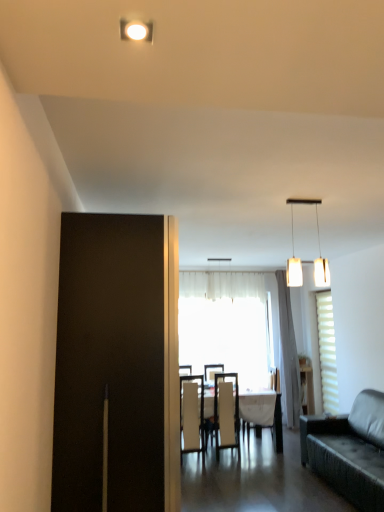
Question: Are white matte pendant lights at upper center and white sheer curtain at center making contact?

Choices:
 (A) yes
 (B) no

Answer: (B)

Question: Can you confirm if white matte pendant lights at upper center is smaller than white sheer curtain at center?

Choices:
 (A) no
 (B) yes

Answer: (B)

Question: Does white matte pendant lights at upper center appear on the right side of white sheer curtain at center?

Choices:
 (A) yes
 (B) no

Answer: (B)

Question: Is white matte pendant lights at upper center aimed at white sheer curtain at center?

Choices:
 (A) yes
 (B) no

Answer: (B)

Question: From a real-world perspective, is white matte pendant lights at upper center below white sheer curtain at center?

Choices:
 (A) yes
 (B) no

Answer: (B)

Question: Is white matte pendant lights at upper center positioned behind white sheer curtain at center?

Choices:
 (A) no
 (B) yes

Answer: (A)

Question: Considering the relative sizes of matte white cabinet at right and white fabric chair at center, acting as the 3th chair starting from the left, in the image provided, is matte white cabinet at right wider than white fabric chair at center, acting as the 3th chair starting from the left,?

Choices:
 (A) yes
 (B) no

Answer: (B)

Question: Does matte white cabinet at right appear on the left side of white fabric chair at center, which is counted as the first chair, starting from the right?

Choices:
 (A) no
 (B) yes

Answer: (A)

Question: Does matte white cabinet at right have a greater height compared to white fabric chair at center, acting as the 3th chair starting from the left?

Choices:
 (A) yes
 (B) no

Answer: (B)

Question: From a real-world perspective, is matte white cabinet at right positioned under white fabric chair at center, which is counted as the first chair, starting from the right, based on gravity?

Choices:
 (A) yes
 (B) no

Answer: (A)

Question: Is the position of matte white cabinet at right more distant than that of white fabric chair at center, which is counted as the first chair, starting from the right?

Choices:
 (A) yes
 (B) no

Answer: (A)

Question: Is matte white cabinet at right turned away from white fabric chair at center, acting as the 3th chair starting from the left?

Choices:
 (A) no
 (B) yes

Answer: (A)

Question: Is white fabric chair at center, arranged as the third chair when viewed from the right, in contact with white sheer curtain at center?

Choices:
 (A) yes
 (B) no

Answer: (B)